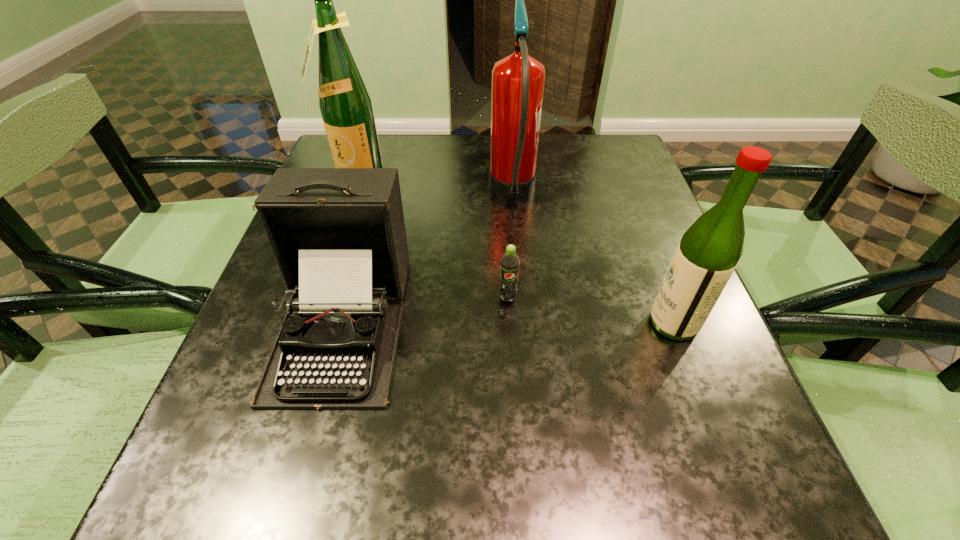
Find the location of a particular element. The image size is (960, 540). the taller liquor is located at coordinates (345, 104).

Where is `the left liquor`? the left liquor is located at coordinates (345, 104).

Identify the location of fire extinguisher. (518, 79).

The width and height of the screenshot is (960, 540). What are the coordinates of `the right liquor` in the screenshot? It's located at (709, 251).

This screenshot has width=960, height=540. I want to click on the rightmost object, so click(x=709, y=251).

Locate an element on the screen. This screenshot has height=540, width=960. typewriter is located at coordinates (338, 235).

Locate an element on the screen. The width and height of the screenshot is (960, 540). soda is located at coordinates (509, 264).

Locate an element on the screen. The width and height of the screenshot is (960, 540). vacant space situated on the front-facing side of the taller liquor is located at coordinates (334, 240).

At what (x,y) coordinates should I click in order to perform the action: click on free space located on the left of the fire extinguisher. Please return your answer as a coordinate pair (x, y). The width and height of the screenshot is (960, 540). Looking at the image, I should click on (x=408, y=192).

The height and width of the screenshot is (540, 960). Identify the location of vacant space situated on the label of the right liquor. point(535,323).